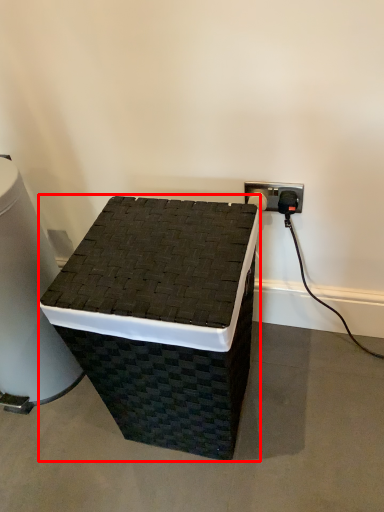
Question: In this image, where is furniture (annotated by the red box) located relative to water cooler?

Choices:
 (A) left
 (B) right

Answer: (B)